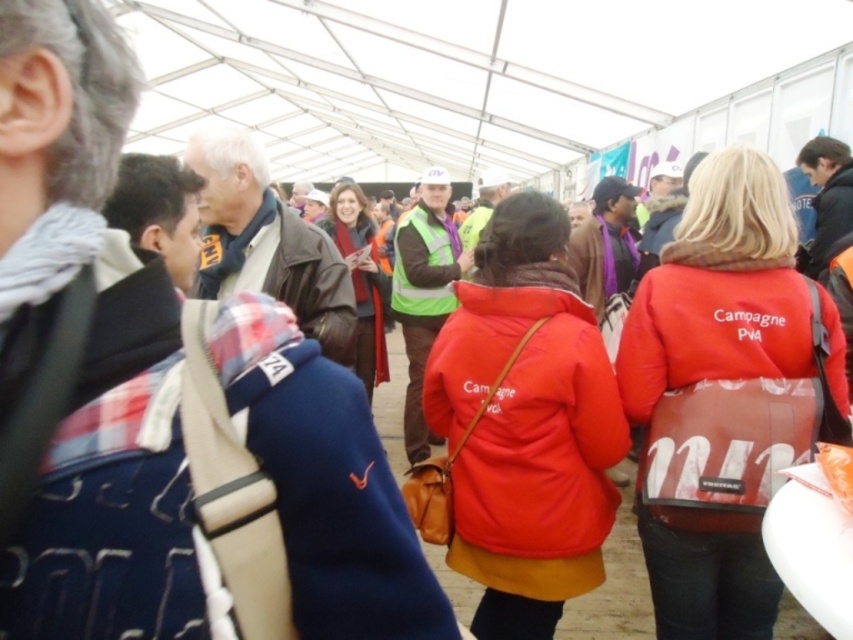
You are a photographer at the event and need to capture both the red matte jacket at center and the dark brown leather jacket at center in a single frame. Which jacket should you focus on to ensure both are in the frame without moving the camera?

The red matte jacket at center is smaller in size compared to the dark brown leather jacket at center. To ensure both are in the frame, focus on the larger dark brown leather jacket at center as it will occupy more space, allowing the smaller red matte jacket at center to remain visible without needing to adjust the camera position.

You are standing at the entrance of the tent and notice two red jackets in the crowd. The first is labeled as the matte red jacket at center, and the second is the red matte jacket at center. Which jacket is positioned lower in the image?

The matte red jacket at center is located below the red matte jacket at center, so the matte red jacket at center is positioned lower in the image.

You are standing at the center of the tent and see the point marked at coordinates (527, 433). Which object is this point located on?

The point at coordinates (527, 433) is located on the matte red jacket at center.